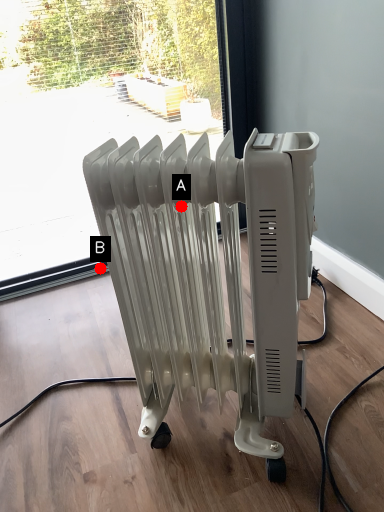
Question: Two points are circled on the image, labeled by A and B beside each circle. Which point is farther to the camera?

Choices:
 (A) A is further
 (B) B is further

Answer: (B)